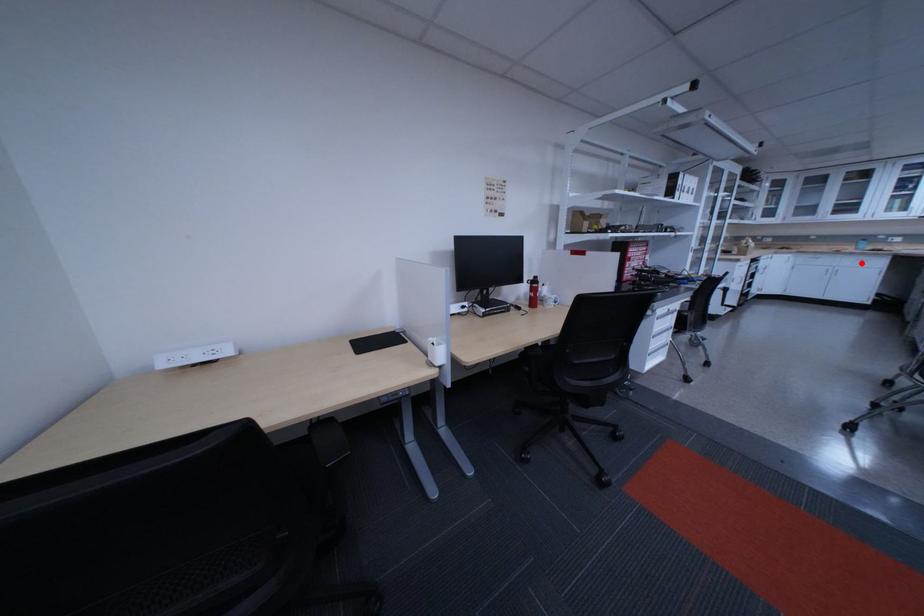
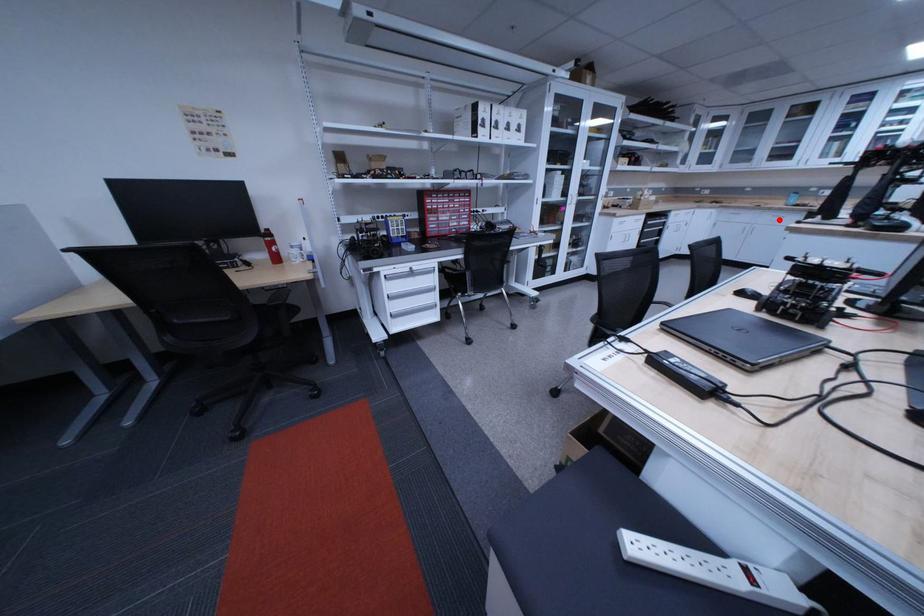
I am providing you with two images of the same scene from different viewpoints. A red point is marked on the first image and another point is marked on the second image. Are the points marked in image1 and image2 representing the same 3D position?

Yes